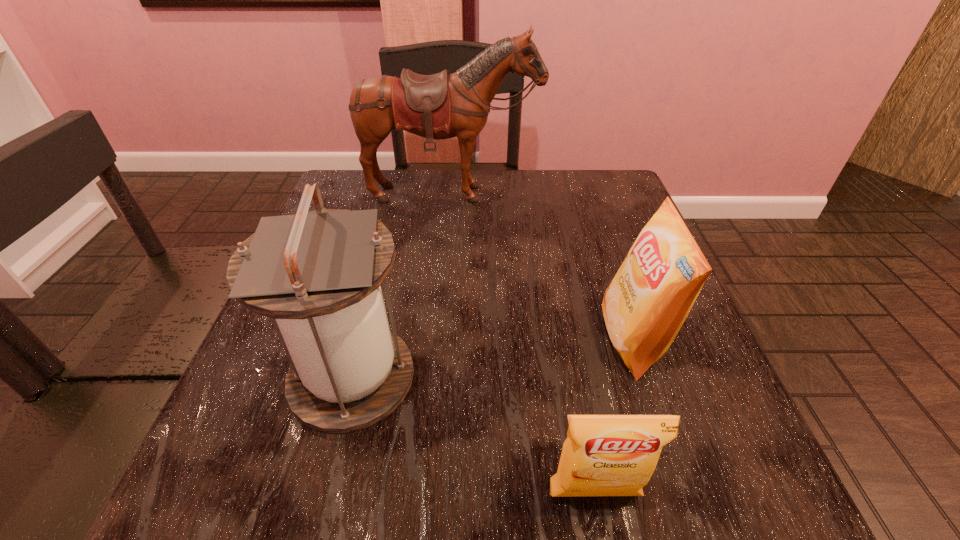
Choose which object is the third nearest neighbor to the third shortest object. Please provide its 2D coordinates. Your answer should be formatted as a tuple, i.e. [(x, y)], where the tuple contains the x and y coordinates of a point satisfying the conditions above.

[(440, 106)]

Where is `object that is the closest one to the tallest object`? Image resolution: width=960 pixels, height=540 pixels. object that is the closest one to the tallest object is located at coordinates (645, 305).

Image resolution: width=960 pixels, height=540 pixels. I want to click on free space in the image that satisfies the following two spatial constraints: 1. on the front-facing side of the rightmost object; 2. on the front of the shorter crisp (potato chip) with the logo, so click(684, 494).

Locate an element on the screen. The width and height of the screenshot is (960, 540). free spot that satisfies the following two spatial constraints: 1. on the front-facing side of the taller crisp (potato chip); 2. on the front of the shortest object with the logo is located at coordinates (684, 494).

At what (x,y) coordinates should I click in order to perform the action: click on blank area in the image that satisfies the following two spatial constraints: 1. on the front-facing side of the third tallest object; 2. on the front side of the third shortest object. Please return your answer as a coordinate pair (x, y). The width and height of the screenshot is (960, 540). Looking at the image, I should click on (645, 377).